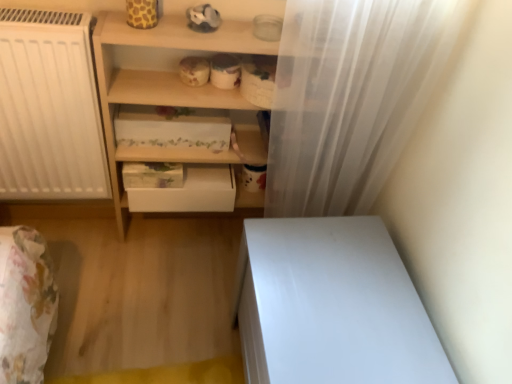
Question: Should I look upward or downward to see white floral-patterned drawer at center, the second shelf from the bottom?

Choices:
 (A) down
 (B) up

Answer: (B)

Question: Is white sheer curtain at right oriented towards white floral-patterned drawer at center, positioned as the first shelf in top-to-bottom order?

Choices:
 (A) no
 (B) yes

Answer: (A)

Question: Is white sheer curtain at right positioned with its back to white floral-patterned drawer at center, positioned as the first shelf in top-to-bottom order?

Choices:
 (A) yes
 (B) no

Answer: (B)

Question: Can you confirm if white sheer curtain at right is thinner than white floral-patterned drawer at center, positioned as the first shelf in top-to-bottom order?

Choices:
 (A) no
 (B) yes

Answer: (B)

Question: Considering the relative sizes of white sheer curtain at right and white floral-patterned drawer at center, the second shelf from the bottom, in the image provided, is white sheer curtain at right shorter than white floral-patterned drawer at center, the second shelf from the bottom,?

Choices:
 (A) no
 (B) yes

Answer: (A)

Question: Is white sheer curtain at right not near white floral-patterned drawer at center, positioned as the first shelf in top-to-bottom order?

Choices:
 (A) yes
 (B) no

Answer: (B)

Question: From the image's perspective, is white sheer curtain at right above white floral-patterned drawer at center, positioned as the first shelf in top-to-bottom order?

Choices:
 (A) yes
 (B) no

Answer: (B)

Question: Is white glossy vanity at lower right positioned far away from white matte drawer at center?

Choices:
 (A) yes
 (B) no

Answer: (B)

Question: From the image's perspective, would you say white glossy vanity at lower right is shown under white matte drawer at center?

Choices:
 (A) no
 (B) yes

Answer: (B)

Question: Is white glossy vanity at lower right facing away from white matte drawer at center?

Choices:
 (A) yes
 (B) no

Answer: (B)

Question: Considering the relative positions of white glossy vanity at lower right and white matte drawer at center in the image provided, is white glossy vanity at lower right in front of white matte drawer at center?

Choices:
 (A) no
 (B) yes

Answer: (B)

Question: Can you confirm if white glossy vanity at lower right is taller than white matte drawer at center?

Choices:
 (A) yes
 (B) no

Answer: (A)

Question: Can you confirm if white glossy vanity at lower right is positioned to the right of white matte drawer at center?

Choices:
 (A) yes
 (B) no

Answer: (A)

Question: Is white floral-patterned drawer at center, positioned as the first shelf in top-to-bottom order, far away from white matte drawer at center?

Choices:
 (A) yes
 (B) no

Answer: (B)